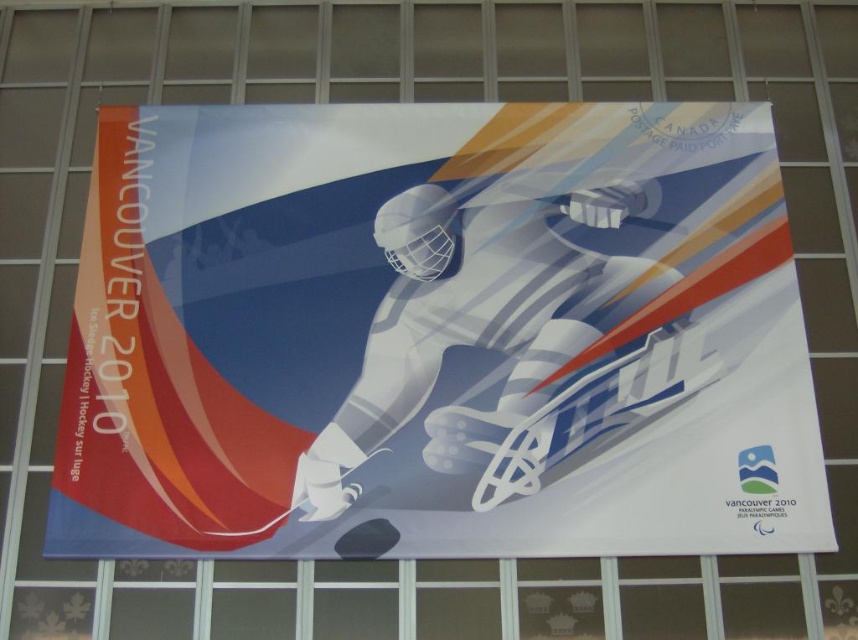
Question: Which object is closer to the camera taking this photo?

Choices:
 (A) matte white hockey player at center
 (B) white glossy astronaut at center

Answer: (A)

Question: Which of the following is the farthest from the observer?

Choices:
 (A) matte white hockey player at center
 (B) white glossy astronaut at center

Answer: (B)

Question: Is matte white hockey player at center bigger than white glossy astronaut at center?

Choices:
 (A) no
 (B) yes

Answer: (B)

Question: Can you confirm if matte white hockey player at center is smaller than white glossy astronaut at center?

Choices:
 (A) yes
 (B) no

Answer: (B)

Question: Does matte white hockey player at center have a smaller size compared to white glossy astronaut at center?

Choices:
 (A) yes
 (B) no

Answer: (B)